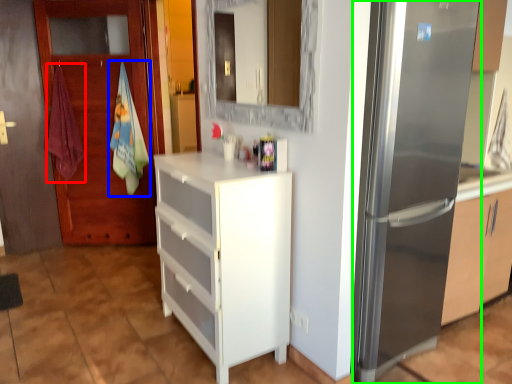
Question: Based on their relative distances, which object is farther from beach towel (highlighted by a red box)? Choose from beach towel (highlighted by a blue box) and refrigerator (highlighted by a green box).

Choices:
 (A) beach towel
 (B) refrigerator

Answer: (B)